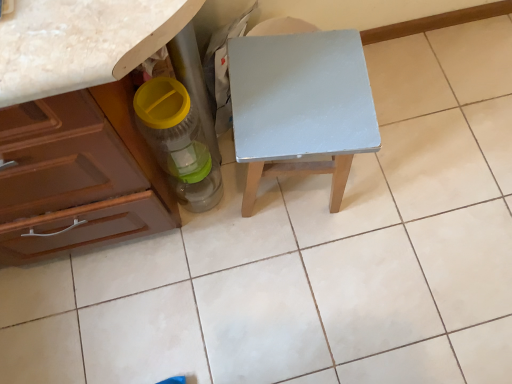
Identify the location of free space to the right of light gray wood table at center. The height and width of the screenshot is (384, 512). click(x=391, y=181).